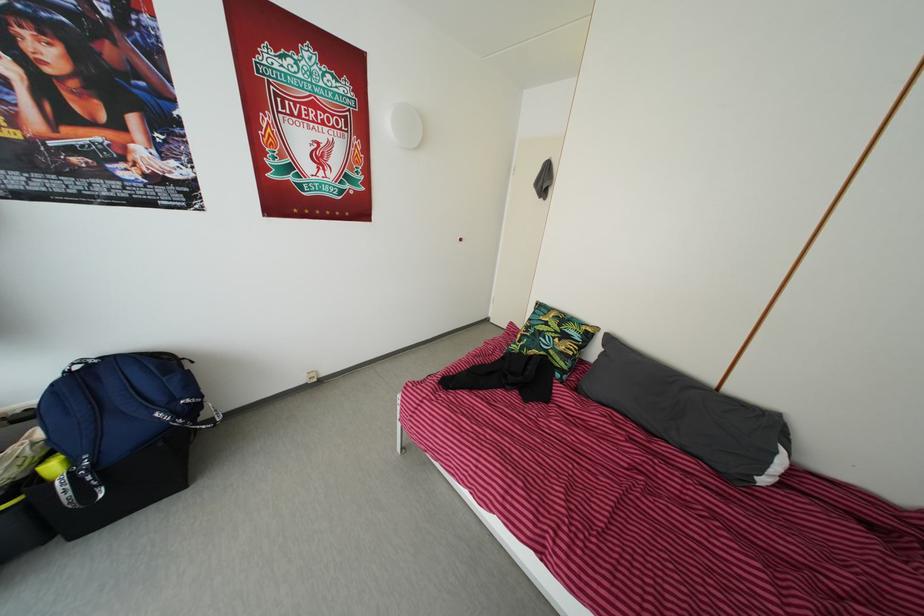
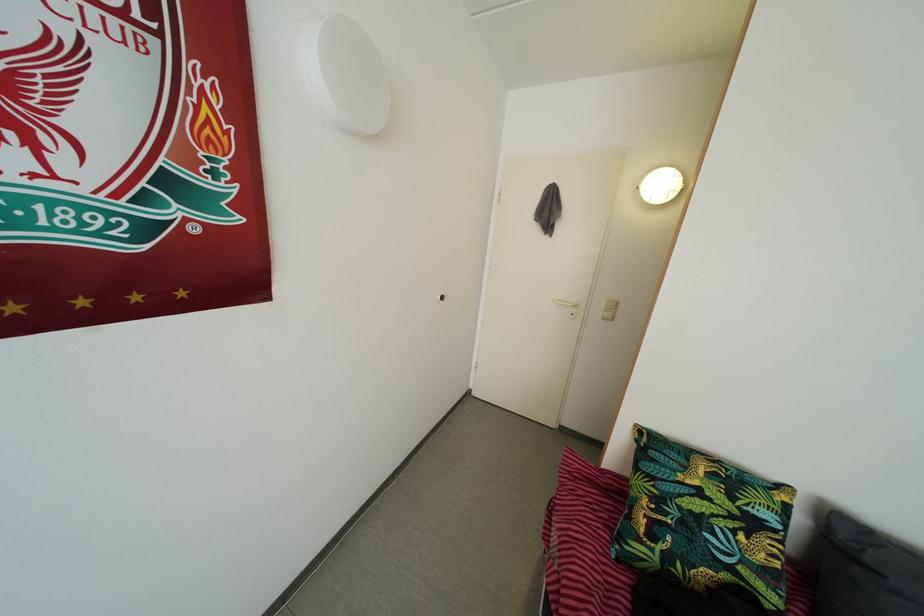
What movement of the cameraman would produce the second image?

The cameraman walked toward left, forward.